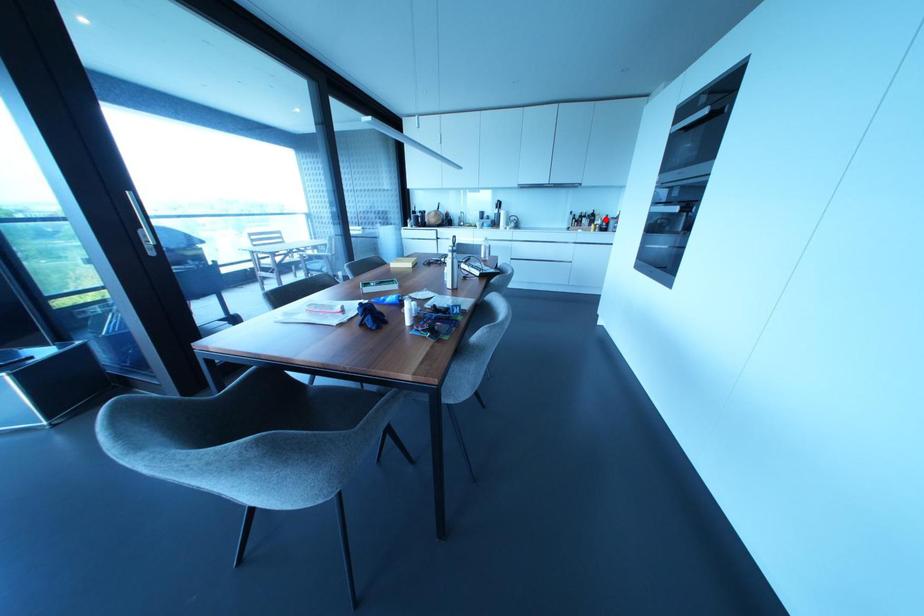
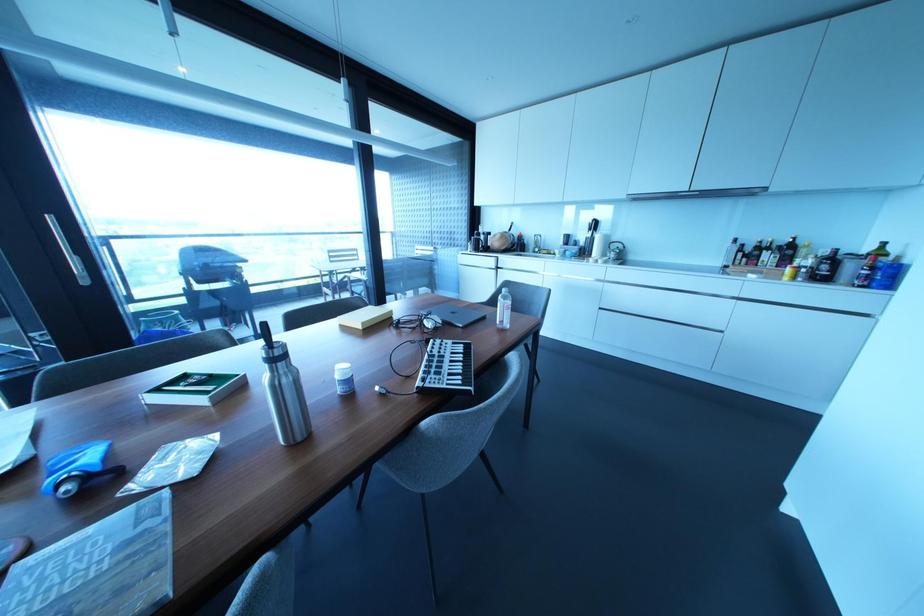
Question: I am providing you with two images of the same scene from different viewpoints. A red point is marked on the first image. At the location where the point appears in image 1, is it still visible in image 2?

Choices:
 (A) Yes
 (B) No

Answer: (A)